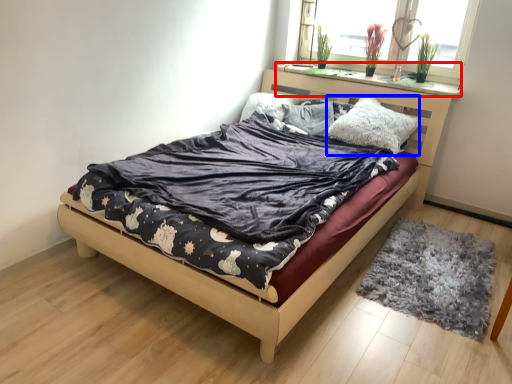
Question: Which of the following is the farthest to the observer, window sill (highlighted by a red box) or pillow (highlighted by a blue box)?

Choices:
 (A) window sill
 (B) pillow

Answer: (A)